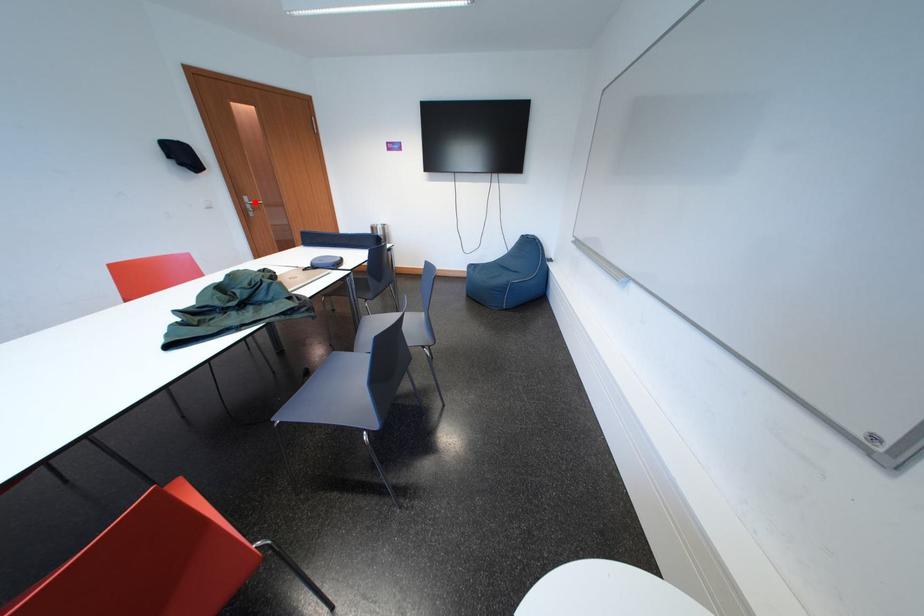
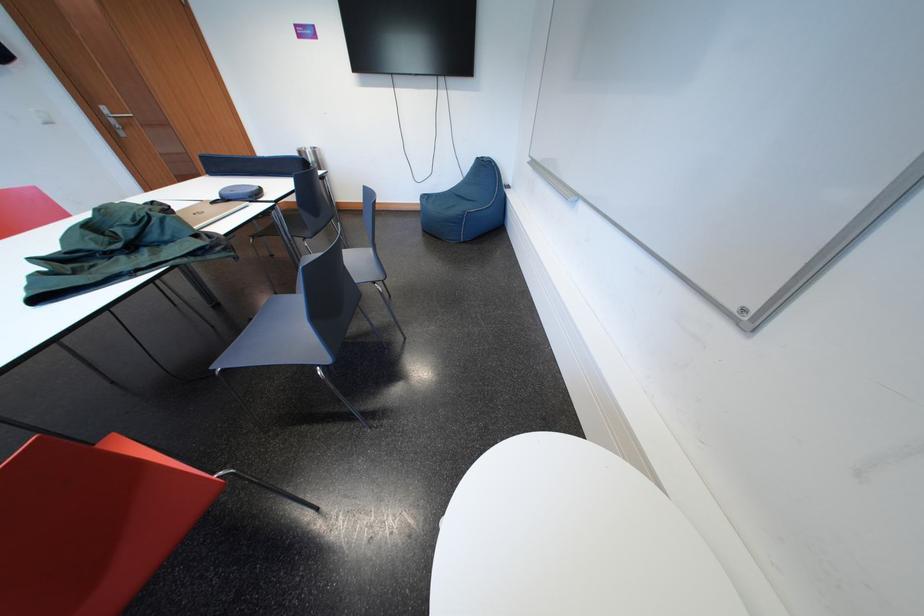
Question: I am providing you with two images of the same scene from different viewpoints. Given a red point in image1, look at the same physical point in image2. Is it:

Choices:
 (A) Closer to the viewpoint
 (B) Farther from the viewpoint

Answer: (B)